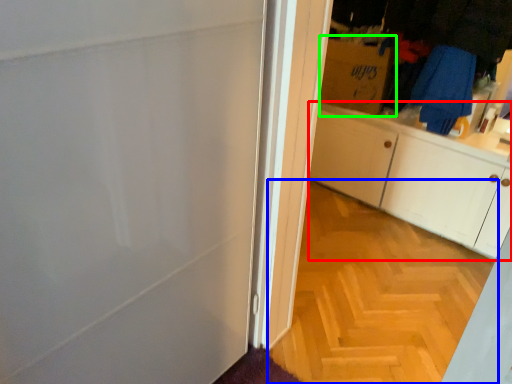
Question: Which is farther away from cabinetry (highlighted by a red box)? plain (highlighted by a blue box) or cardboard box (highlighted by a green box)?

Choices:
 (A) plain
 (B) cardboard box

Answer: (A)